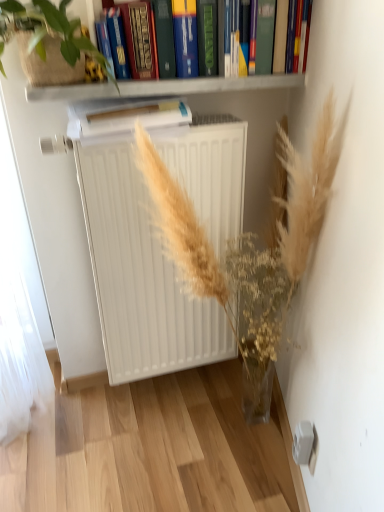
Question: Is hardcover book at upper center, the first paperback book when ordered from top to bottom, beside white paper at center, which appears as the first paperback book when ordered from the bottom?

Choices:
 (A) no
 (B) yes

Answer: (A)

Question: Is hardcover book at upper center, the 2th paperback book from the bottom, wider than white paper at center, which appears as the first paperback book when ordered from the bottom?

Choices:
 (A) no
 (B) yes

Answer: (A)

Question: Can you confirm if hardcover book at upper center, the first paperback book when ordered from top to bottom, is smaller than white paper at center, which appears as the first paperback book when ordered from the bottom?

Choices:
 (A) yes
 (B) no

Answer: (A)

Question: Considering the relative positions of hardcover book at upper center, the first paperback book when ordered from top to bottom, and white paper at center, which appears as the first paperback book when ordered from the bottom, in the image provided, is hardcover book at upper center, the first paperback book when ordered from top to bottom, to the right of white paper at center, which appears as the first paperback book when ordered from the bottom, from the viewer's perspective?

Choices:
 (A) yes
 (B) no

Answer: (B)

Question: From a real-world perspective, is hardcover book at upper center, the 2th paperback book from the bottom, beneath white paper at center, which appears as the first paperback book when ordered from the bottom?

Choices:
 (A) yes
 (B) no

Answer: (B)

Question: Would you say hardcover book at upper center, the first paperback book when ordered from top to bottom, is outside white paper at center, which appears as the first paperback book when ordered from the bottom?

Choices:
 (A) no
 (B) yes

Answer: (B)

Question: Considering the relative sizes of hardcover book at upper center and translucent glass vase at center in the image provided, is hardcover book at upper center wider than translucent glass vase at center?

Choices:
 (A) no
 (B) yes

Answer: (A)

Question: Is hardcover book at upper center taller than translucent glass vase at center?

Choices:
 (A) no
 (B) yes

Answer: (A)

Question: From a real-world perspective, is hardcover book at upper center located beneath translucent glass vase at center?

Choices:
 (A) yes
 (B) no

Answer: (B)

Question: Considering the relative sizes of hardcover book at upper center and translucent glass vase at center in the image provided, is hardcover book at upper center shorter than translucent glass vase at center?

Choices:
 (A) yes
 (B) no

Answer: (A)

Question: Considering the relative sizes of hardcover book at upper center and translucent glass vase at center in the image provided, is hardcover book at upper center thinner than translucent glass vase at center?

Choices:
 (A) no
 (B) yes

Answer: (B)

Question: Could you tell me if hardcover book at upper center is turned towards translucent glass vase at center?

Choices:
 (A) no
 (B) yes

Answer: (A)

Question: Does green leafy plant at upper left have a greater width compared to white matte radiator at center?

Choices:
 (A) yes
 (B) no

Answer: (A)